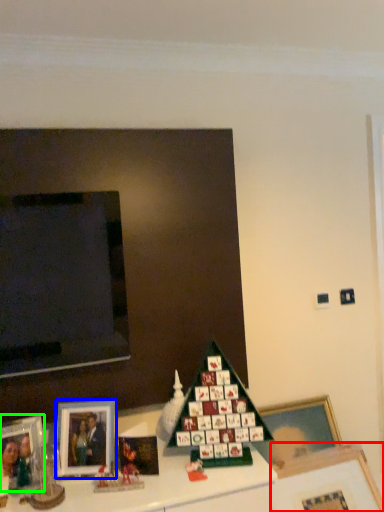
Question: Which is nearer to the picture frame (highlighted by a red box)? picture frame (highlighted by a blue box) or picture frame (highlighted by a green box).

Choices:
 (A) picture frame
 (B) picture frame

Answer: (A)